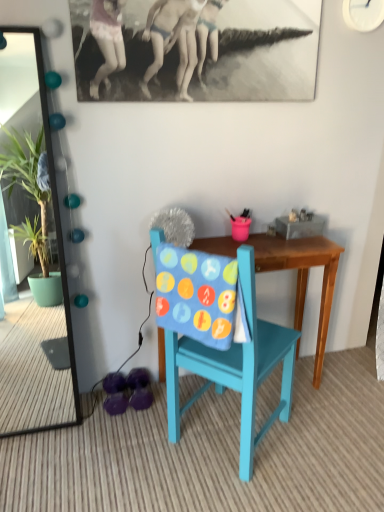
Where is `space that is in front of purple fabric footwear at lower left`? The width and height of the screenshot is (384, 512). space that is in front of purple fabric footwear at lower left is located at coordinates (134, 423).